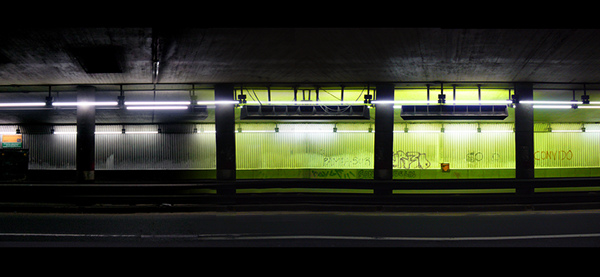
Find the location of a particular element. vent is located at coordinates (107, 57).